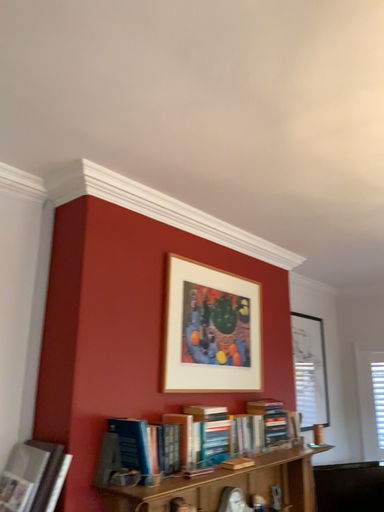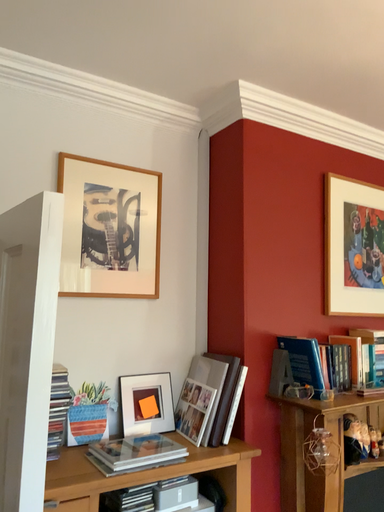
Question: Which way did the camera rotate in the video?

Choices:
 (A) rotated upward
 (B) rotated downward

Answer: (B)